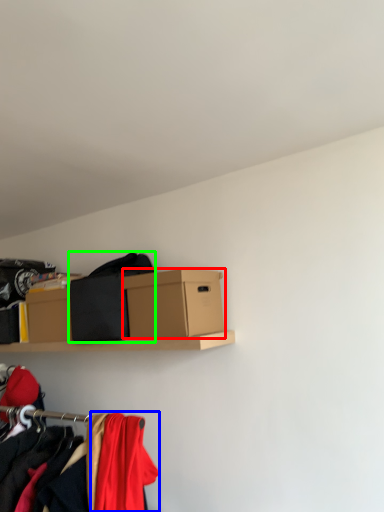
Question: Based on their relative distances, which object is farther from box (highlighted by a red box)? Choose from clothing (highlighted by a blue box) and clothing (highlighted by a green box).

Choices:
 (A) clothing
 (B) clothing

Answer: (A)